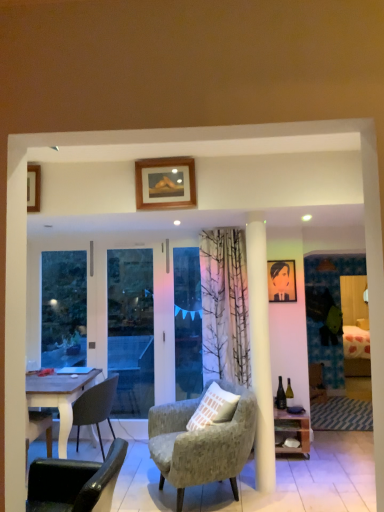
Question: Does textured gray armchair at center, arranged as the second chair when viewed from the front, have a smaller size compared to green glass bottle at center-right?

Choices:
 (A) yes
 (B) no

Answer: (B)

Question: Is textured gray armchair at center, arranged as the 1th chair when viewed from the right, taller than green glass bottle at center-right?

Choices:
 (A) no
 (B) yes

Answer: (B)

Question: Is there a large distance between textured gray armchair at center, which is the 3th chair from left to right, and green glass bottle at center-right?

Choices:
 (A) yes
 (B) no

Answer: (A)

Question: Is green glass bottle at center-right completely or partially inside textured gray armchair at center, which is the 3th chair from left to right?

Choices:
 (A) no
 (B) yes

Answer: (A)

Question: Is textured gray armchair at center, which is the 3th chair from left to right, not within green glass bottle at center-right?

Choices:
 (A) no
 (B) yes

Answer: (B)

Question: Visually, is wooden shelf at lower right positioned to the left or to the right of green glass bottle at center-right?

Choices:
 (A) right
 (B) left

Answer: (B)

Question: Would you say wooden shelf at lower right is inside or outside green glass bottle at center-right?

Choices:
 (A) inside
 (B) outside

Answer: (B)

Question: From a real-world perspective, relative to green glass bottle at center-right, is wooden shelf at lower right vertically above or below?

Choices:
 (A) below
 (B) above

Answer: (A)

Question: From the image's perspective, is wooden shelf at lower right positioned above or below green glass bottle at center-right?

Choices:
 (A) above
 (B) below

Answer: (B)

Question: Based on their positions, is transparent glass screen door at left located to the left or right of black leather chair at lower left, which ranks as the third chair in back-to-front order?

Choices:
 (A) right
 (B) left

Answer: (B)

Question: In terms of height, does transparent glass screen door at left look taller or shorter compared to black leather chair at lower left, the second chair positioned from the right?

Choices:
 (A) short
 (B) tall

Answer: (B)

Question: Considering the positions of transparent glass screen door at left and black leather chair at lower left, which ranks as the third chair in back-to-front order, in the image, is transparent glass screen door at left bigger or smaller than black leather chair at lower left, which ranks as the third chair in back-to-front order,?

Choices:
 (A) small
 (B) big

Answer: (B)

Question: Do you think transparent glass screen door at left is within black leather chair at lower left, the second chair positioned from the right, or outside of it?

Choices:
 (A) inside
 (B) outside

Answer: (B)

Question: From the image's perspective, is transparent glass screen door at left located above or below textured gray armchair at center, which is the 3th chair from left to right?

Choices:
 (A) below
 (B) above

Answer: (B)

Question: In terms of size, does transparent glass screen door at left appear bigger or smaller than textured gray armchair at center, which is the 3th chair from left to right?

Choices:
 (A) small
 (B) big

Answer: (A)